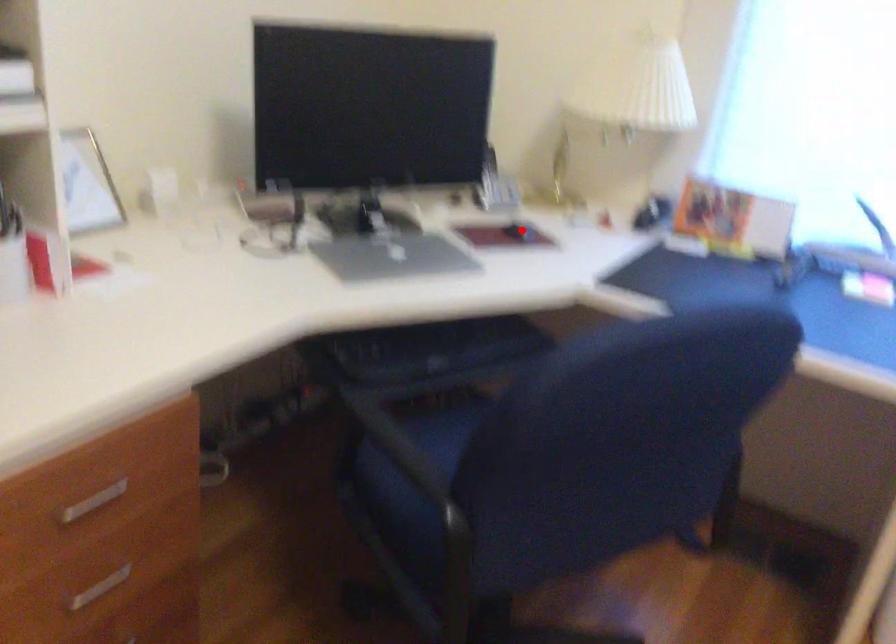
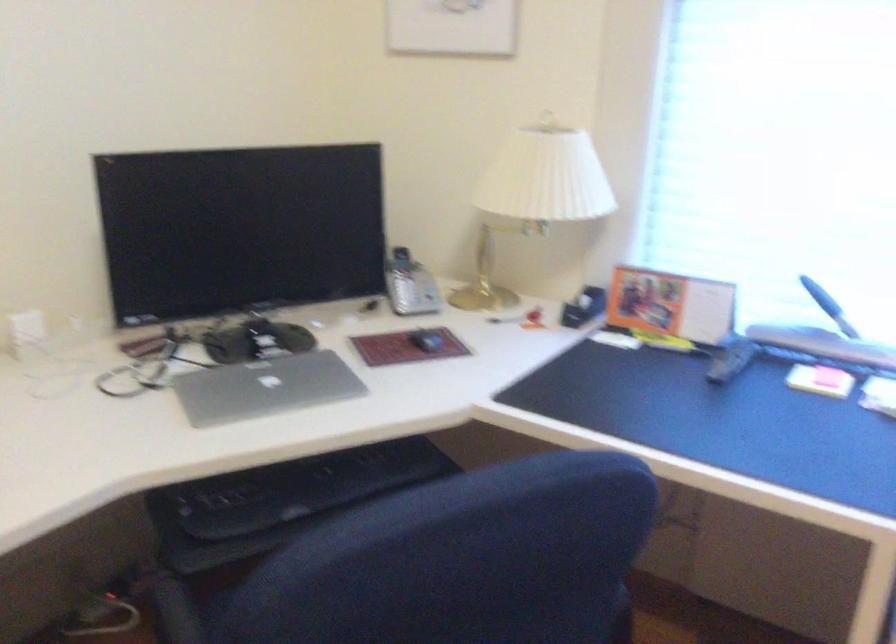
Find the pixel in the second image that matches the highlighted location in the first image.

(426, 341)